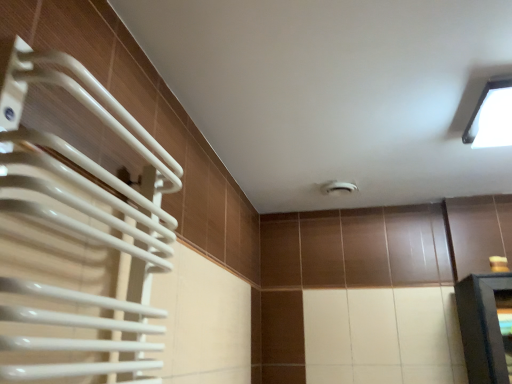
Measure the distance between transparent glass window at upper right and camera.

transparent glass window at upper right and camera are 1.38 meters apart.

What do you see at coordinates (490, 116) in the screenshot?
I see `transparent glass window at upper right` at bounding box center [490, 116].

In order to face transparent glass window at upper right, should I rotate leftwards or rightwards?

Turn right by 29.962 degrees to look at transparent glass window at upper right.

Image resolution: width=512 pixels, height=384 pixels. What are the coordinates of `transparent glass window at upper right` in the screenshot? It's located at (490, 116).

This screenshot has width=512, height=384. What are the coordinates of `transparent glass window at upper right` in the screenshot? It's located at (490, 116).